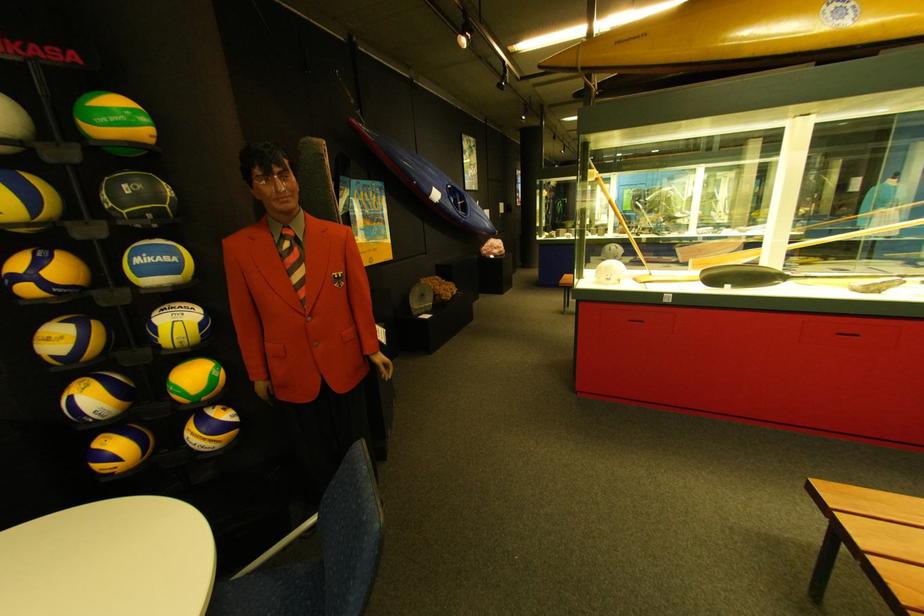
Find where to lift the grey stone disc. Please return your answer as a coordinate pair (x, y).

(419, 299)